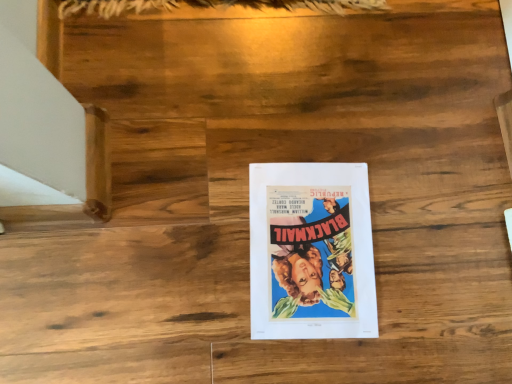
At what (x,y) coordinates should I click in order to perform the action: click on blank space situated above vibrant paper poster at center (from a real-world perspective). Please return your answer as a coordinate pair (x, y). The image size is (512, 384). Looking at the image, I should click on (309, 248).